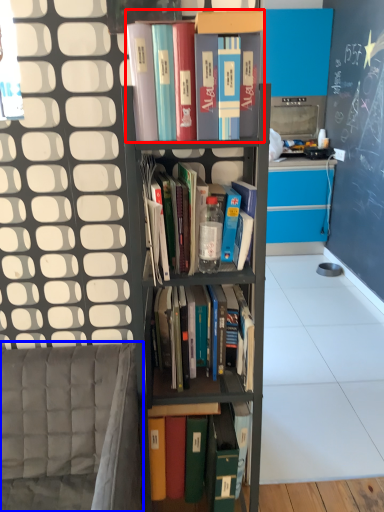
Question: Which point is further to the camera, book (highlighted by a red box) or armchair (highlighted by a blue box)?

Choices:
 (A) book
 (B) armchair

Answer: (A)